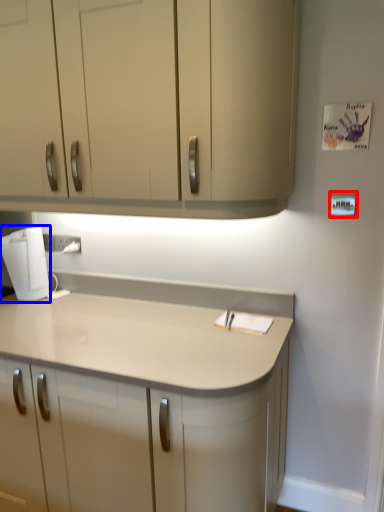
Question: Which object is closer to the camera taking this photo, light switch (highlighted by a red box) or home appliance (highlighted by a blue box)?

Choices:
 (A) light switch
 (B) home appliance

Answer: (A)